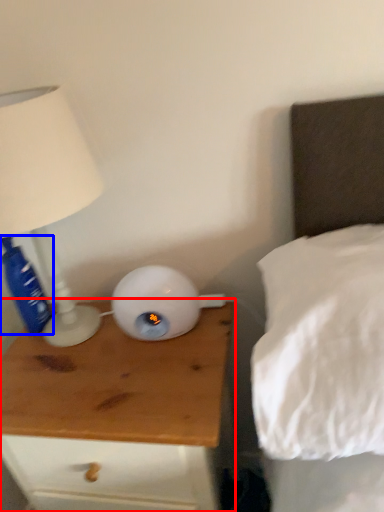
Question: Among these objects, which one is nearest to the camera, nightstand (highlighted by a red box) or bottle (highlighted by a blue box)?

Choices:
 (A) nightstand
 (B) bottle

Answer: (A)